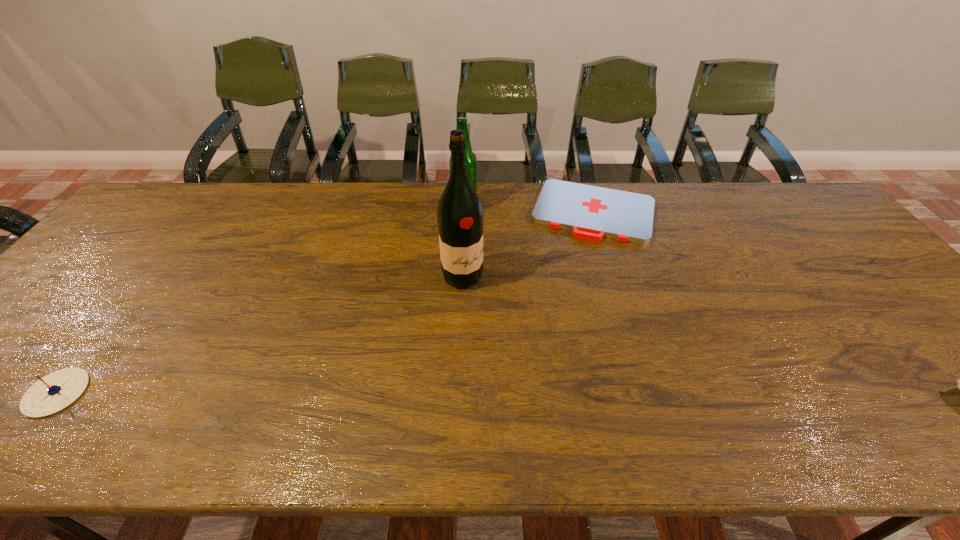
Where is `object situated at the left edge`? object situated at the left edge is located at coordinates (54, 392).

This screenshot has height=540, width=960. I want to click on object positioned at the near left corner, so click(54, 392).

The height and width of the screenshot is (540, 960). In order to click on free space at the far edge of the desktop in this screenshot , I will do `click(405, 191)`.

The height and width of the screenshot is (540, 960). In the image, there is a desktop. Identify the location of free space at the near edge. (606, 372).

This screenshot has width=960, height=540. Identify the location of vacant area at the left edge. (129, 237).

The image size is (960, 540). Identify the location of empty space that is in between the second nearest object and the first-aid kit. (528, 244).

Find the location of a particular element. object that stands as the second closest to the shortest object is located at coordinates (460, 216).

Locate an element on the screen. the third closest object to the liquor is located at coordinates (54, 392).

The height and width of the screenshot is (540, 960). In order to click on free space that satisfies the following two spatial constraints: 1. on the front side of the third farthest object; 2. on the right side of the beer bottle in this screenshot , I will do `click(462, 276)`.

Where is `free space that satisfies the following two spatial constraints: 1. on the back side of the third tallest object; 2. on the right side of the third shortest object`? The height and width of the screenshot is (540, 960). free space that satisfies the following two spatial constraints: 1. on the back side of the third tallest object; 2. on the right side of the third shortest object is located at coordinates (201, 208).